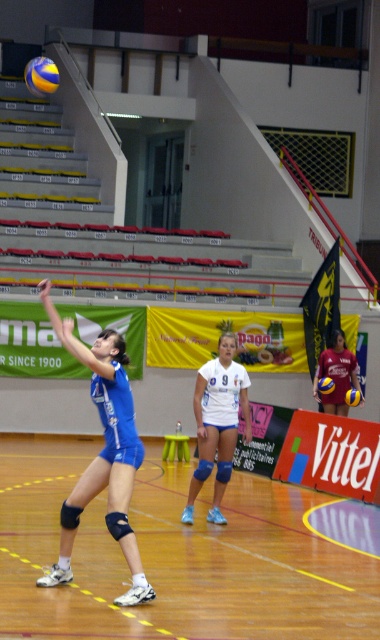
You are a volleyball coach observing the game. You notice two points marked on the court. The first point is at coordinate point (83, 499) and the second is at point (356, 394). Based on their positions, which point is closer to the net?

Point (83, 499) is in front of point (356, 394), so it is closer to the net.

You are a photographer positioned at the back of the gymnasium. You want to take a photo of the blue uniform at center and the yellow and blue textured volleyball at center. Based on their positions, which object should you adjust your camera focus to first to ensure both are in the frame?

The blue uniform at center is to the left of the yellow and blue textured volleyball at center, so you should focus on the blue uniform at center first to ensure both are in the frame.